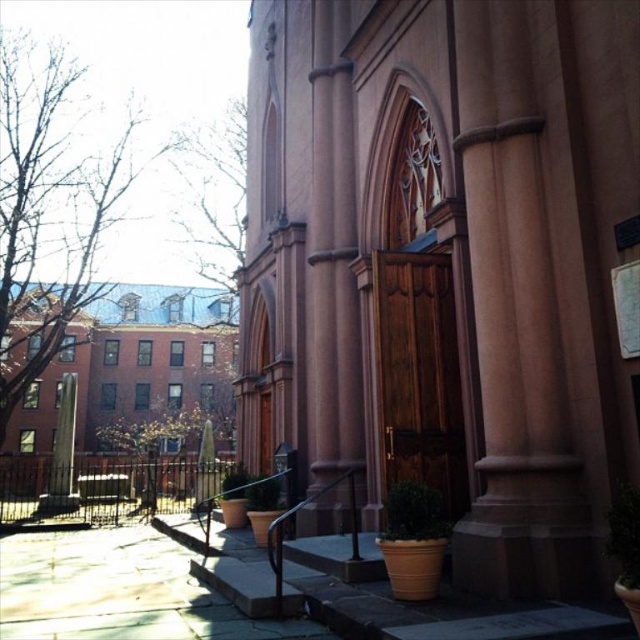
You are standing at the bottom of the steps looking up at the historic building. Which structure, the smooth pink stone church at center or the brown brick building at left, is positioned higher in elevation?

The smooth pink stone church at center is positioned higher in elevation than the brown brick building at left because it is located above it.